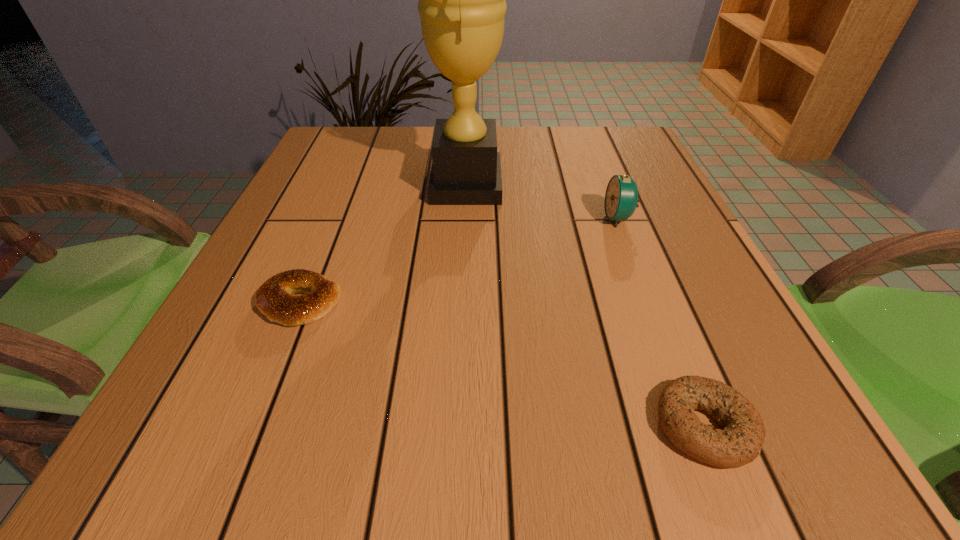
You are a GUI agent. You are given a task and a screenshot of the screen. Output one action in this format:
    pyautogui.click(x=<x>, y=<y>)
    Task: Click on the free area in between the nearer bagel and the third shortest object
    
    Given the screenshot: What is the action you would take?
    pyautogui.click(x=661, y=322)

The height and width of the screenshot is (540, 960). Find the location of `free space between the alarm clock and the left bagel`. free space between the alarm clock and the left bagel is located at coordinates (460, 260).

Identify the location of vacant space that's between the third farthest object and the third object from right to left. (383, 244).

Locate an element on the screen. The height and width of the screenshot is (540, 960). empty space that is in between the right bagel and the farther bagel is located at coordinates (502, 364).

The image size is (960, 540). I want to click on vacant area that lies between the alarm clock and the leftmost object, so click(460, 260).

You are a GUI agent. You are given a task and a screenshot of the screen. Output one action in this format:
    pyautogui.click(x=<x>, y=<y>)
    Task: Click on the free space between the second tallest object and the nearest object
    The width and height of the screenshot is (960, 540).
    Given the screenshot: What is the action you would take?
    [x=661, y=322]

The width and height of the screenshot is (960, 540). Find the location of `object that stands as the second closest to the left bagel`. object that stands as the second closest to the left bagel is located at coordinates (740, 441).

Choose which object is the nearest neighbor to the leftmost object. Please provide its 2D coordinates. Your answer should be formatted as a tuple, i.e. [(x, y)], where the tuple contains the x and y coordinates of a point satisfying the conditions above.

[(462, 6)]

I want to click on free space that satisfies the following two spatial constraints: 1. at the front of the trophy cup with handles; 2. on the right side of the nearest object, so click(x=456, y=426).

Where is `vacant region that satisfies the following two spatial constraints: 1. on the front side of the leftmost object; 2. on the right side of the nearer bagel`? vacant region that satisfies the following two spatial constraints: 1. on the front side of the leftmost object; 2. on the right side of the nearer bagel is located at coordinates (251, 426).